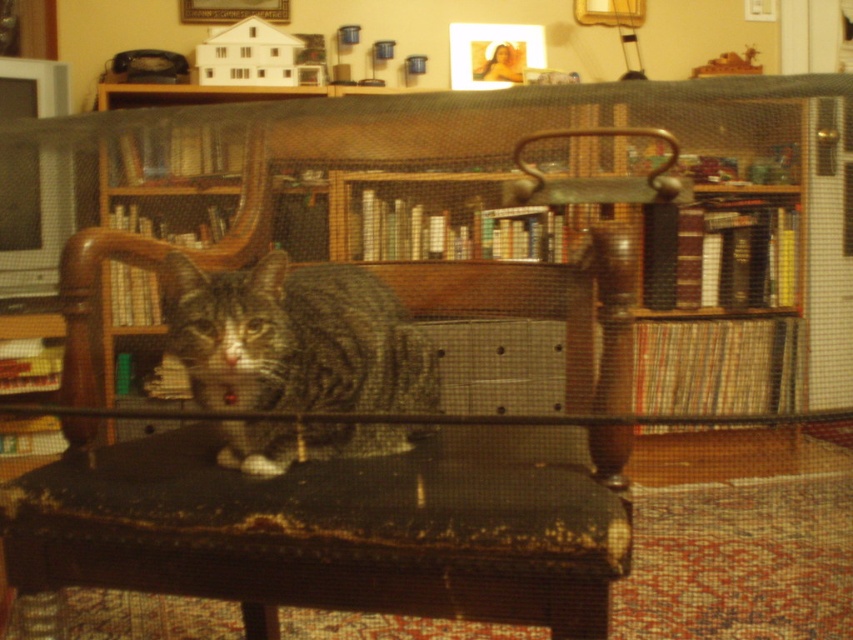
Does dark brown wooden table at center come in front of wooden bookshelf at center?

Yes, dark brown wooden table at center is in front of wooden bookshelf at center.

In the scene shown: Between dark brown wooden table at center and wooden bookshelf at center, which one appears on the left side from the viewer's perspective?

dark brown wooden table at center

Does point (318, 481) come in front of point (291, 138)?

Yes, it is.

The image size is (853, 640). I want to click on dark brown wooden table at center, so click(x=323, y=534).

Can you confirm if dark brown wooden table at center is positioned to the right of tabby fur cat at center?

Yes, dark brown wooden table at center is to the right of tabby fur cat at center.

Who is shorter, dark brown wooden table at center or tabby fur cat at center?

Standing shorter between the two is dark brown wooden table at center.

You are a GUI agent. You are given a task and a screenshot of the screen. Output one action in this format:
    pyautogui.click(x=<x>, y=<y>)
    Task: Click on the dark brown wooden table at center
    The image size is (853, 640).
    Given the screenshot: What is the action you would take?
    pyautogui.click(x=323, y=534)

Where is `dark brown wooden table at center`? dark brown wooden table at center is located at coordinates (323, 534).

Consider the image. Between dark brown leather armchair at center and dark brown wooden table at center, which one has less height?

dark brown wooden table at center is shorter.

Which is behind, point (3, 540) or point (180, 467)?

The point (180, 467) is behind.

I want to click on dark brown leather armchair at center, so click(x=351, y=468).